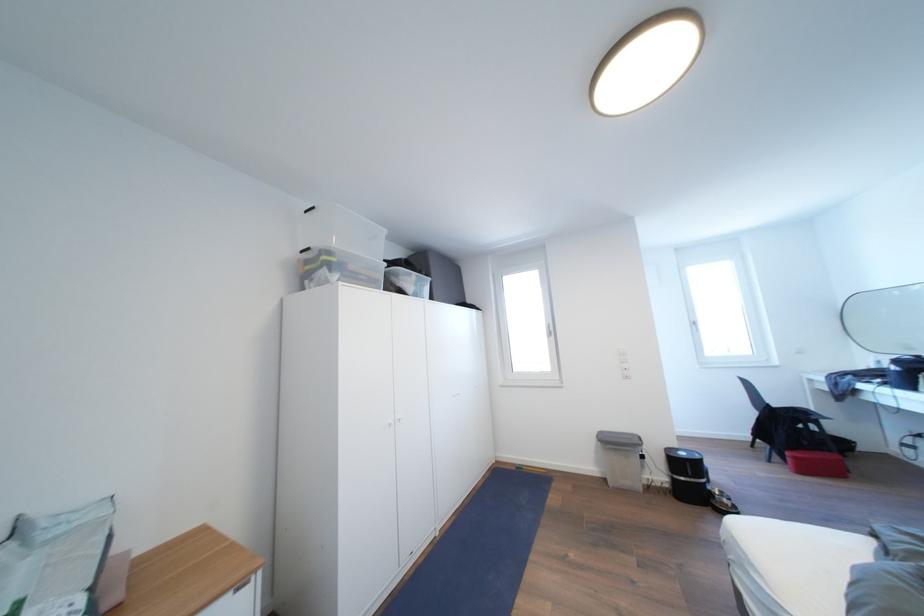
Where would you lift the red storage box? Please return your answer as a coordinate pair (x, y).

(816, 464)